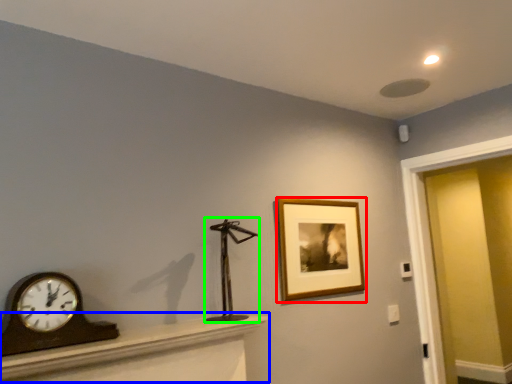
Question: Which is farther away from picture frame (highlighted by a red box)? furniture (highlighted by a blue box) or sculpture (highlighted by a green box)?

Choices:
 (A) furniture
 (B) sculpture

Answer: (A)